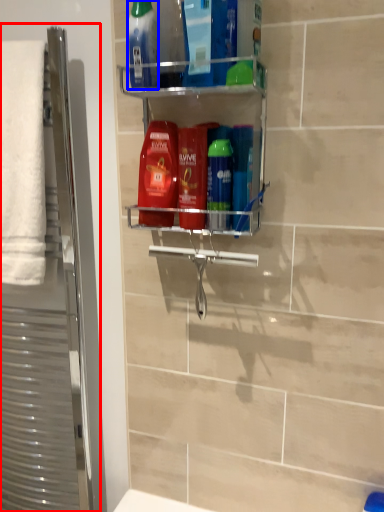
Question: Which object appears closest to the camera in this image, screen door (highlighted by a red box) or mouthwash (highlighted by a blue box)?

Choices:
 (A) screen door
 (B) mouthwash

Answer: (B)